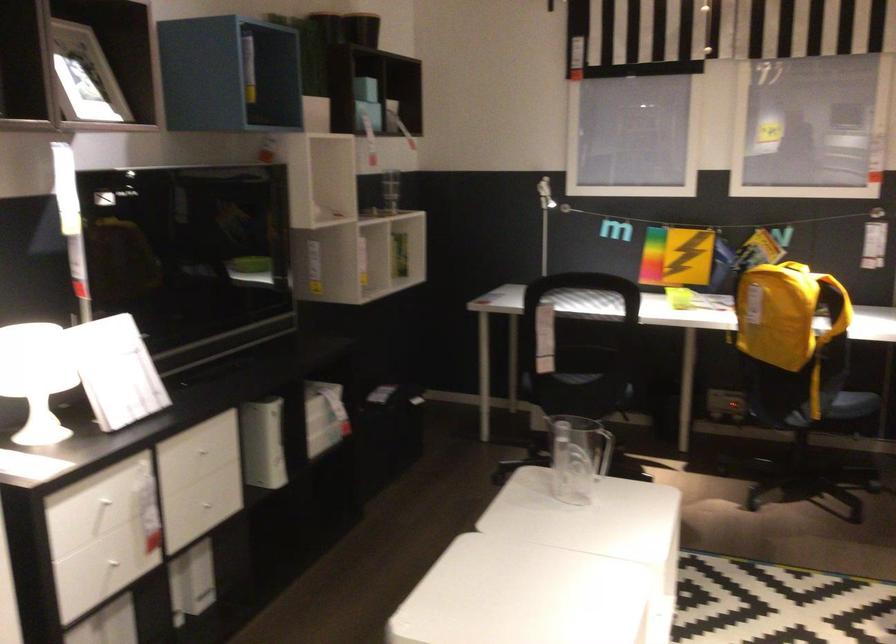
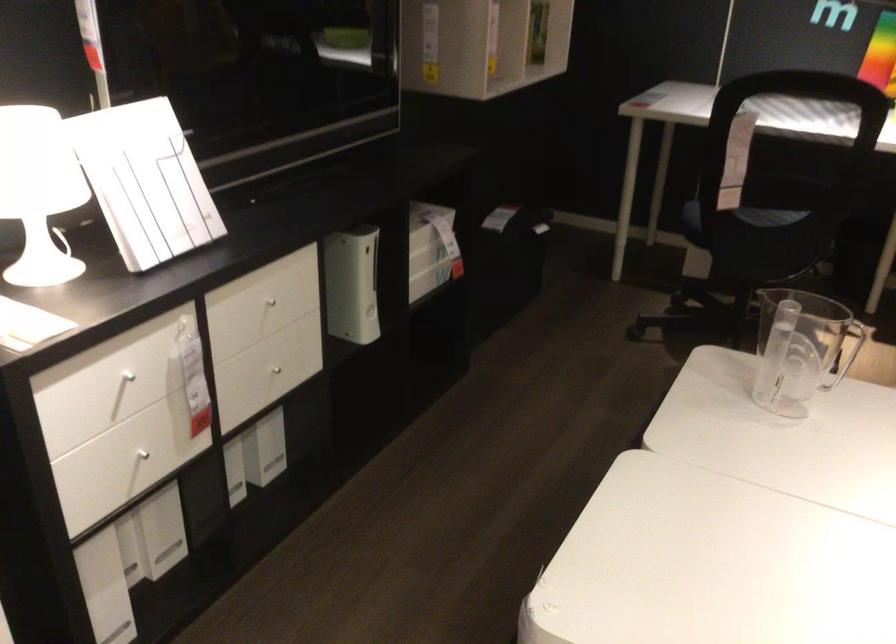
The point at (211, 504) is marked in the first image. Where is the corresponding point in the second image?

(279, 366)